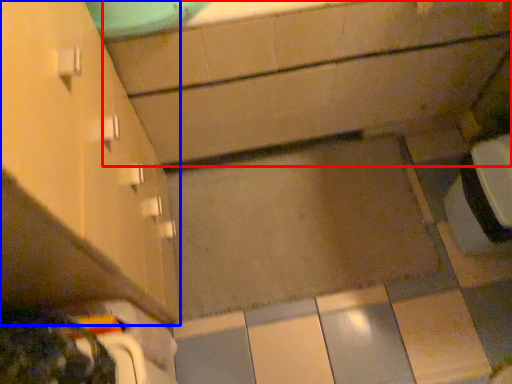
Question: Which of the following is the closest to the observer, bath (highlighted by a red box) or cabinetry (highlighted by a blue box)?

Choices:
 (A) bath
 (B) cabinetry

Answer: (B)